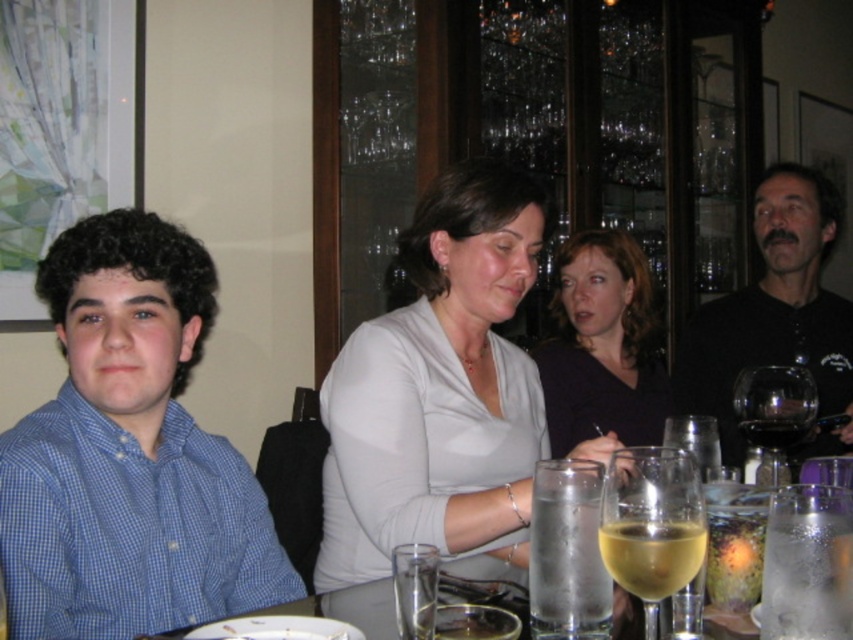
You are a photographer taking a picture of the scene. You notice two points marked in the image at coordinates point (613,524) and point (770,449). Which point should you focus on to ensure the subject closest to the camera is in sharp focus?

You should focus on point (613,524) because it is closer to the camera than point (770,449), ensuring the subject nearest to the camera is in sharp focus.

You are a waiter at the restaurant and need to place a new drink order for the dark purple shirt at center and the transparent glass wine glass at right. Based on their current positions, which object is closer to the edge of the table?

The transparent glass wine glass at right is closer to the edge of the table because the dark purple shirt at center is located above it, meaning the shirt is positioned further inward on the table.

Consider the image. You are a waiter at the restaurant and need to place a new drink order between the yellow translucent wine glass at lower center and the clear glass wine at center. Which side should you place it on to maintain the existing arrangement?

The yellow translucent wine glass at lower center is positioned on the left side of clear glass wine at center, so you should place the new drink order to the right of the yellow translucent wine glass at lower center and to the left of the clear glass wine at center to maintain the existing arrangement.